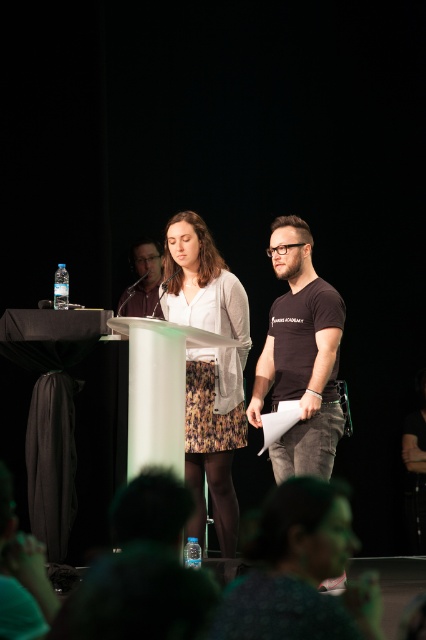
Does green textured shirt at lower center have a lesser height compared to black matte t-shirt at center?

Yes, green textured shirt at lower center is shorter than black matte t-shirt at center.

Is green textured shirt at lower center closer to the viewer compared to black matte t-shirt at center?

Yes, green textured shirt at lower center is closer to the viewer.

This screenshot has width=426, height=640. Identify the location of green textured shirt at lower center. (299, 572).

Who is positioned more to the right, green textured shirt at lower center or printed fabric skirt at center?

green textured shirt at lower center

Is point (227, 627) more distant than point (215, 444)?

That is False.

Locate an element on the screen. Image resolution: width=426 pixels, height=640 pixels. green textured shirt at lower center is located at coordinates (299, 572).

Is point (310, 614) positioned before point (150, 252)?

Yes, point (310, 614) is in front of point (150, 252).

Is green textured shirt at lower center to the right of matte black microphone at center from the viewer's perspective?

Indeed, green textured shirt at lower center is positioned on the right side of matte black microphone at center.

Where is `green textured shirt at lower center`? The height and width of the screenshot is (640, 426). green textured shirt at lower center is located at coordinates (299, 572).